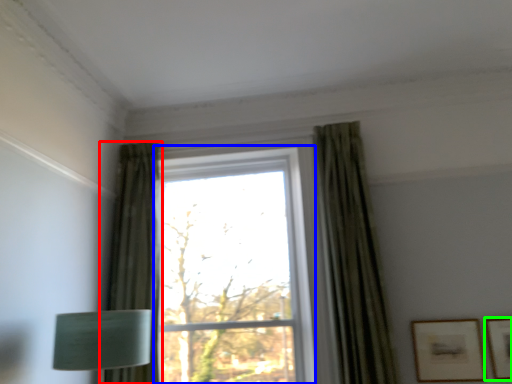
Question: Which object is positioned closest to curtain (highlighted by a red box)? Select from window (highlighted by a blue box) and picture frame (highlighted by a green box).

Choices:
 (A) window
 (B) picture frame

Answer: (A)